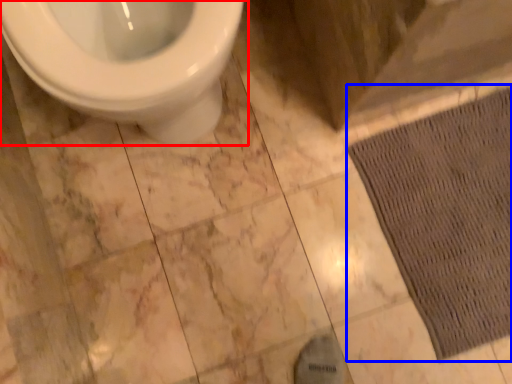
Question: Which object appears closest to the camera in this image, toilet (highlighted by a red box) or doormat (highlighted by a blue box)?

Choices:
 (A) toilet
 (B) doormat

Answer: (A)